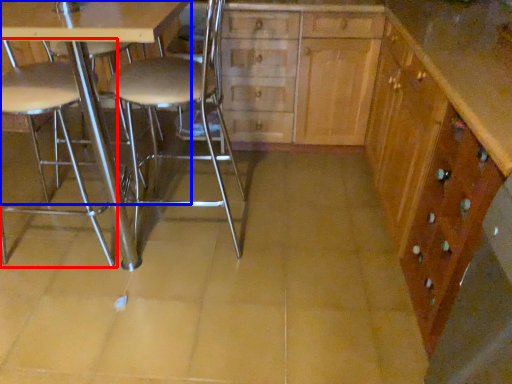
Question: Among these objects, which one is nearest to the camera, chair (highlighted by a red box) or table (highlighted by a blue box)?

Choices:
 (A) chair
 (B) table

Answer: (B)